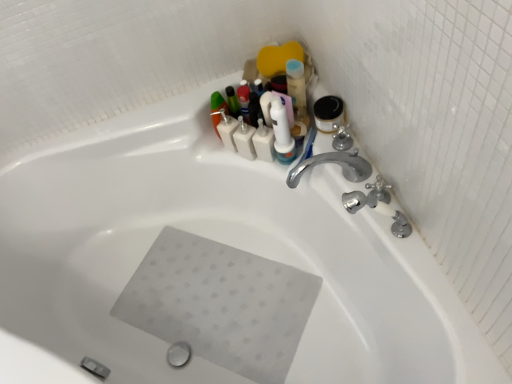
Question: From a real-world perspective, is silver metallic faucet at upper right, the second plumbing fixture positioned from the back, over white plastic toothbrush at upper center, which is the first toiletry from right to left?

Choices:
 (A) yes
 (B) no

Answer: (A)

Question: Is silver metallic faucet at upper right, which ranks as the first plumbing fixture in front-to-back order, far away from white plastic toothbrush at upper center, the 2th toiletry when ordered from left to right?

Choices:
 (A) no
 (B) yes

Answer: (A)

Question: Does silver metallic faucet at upper right, the second plumbing fixture positioned from the back, have a smaller size compared to white plastic toothbrush at upper center, the 2th toiletry when ordered from left to right?

Choices:
 (A) no
 (B) yes

Answer: (A)

Question: From the image's perspective, is silver metallic faucet at upper right, which ranks as the first plumbing fixture in front-to-back order, beneath white plastic toothbrush at upper center, the 2th toiletry when ordered from left to right?

Choices:
 (A) no
 (B) yes

Answer: (B)

Question: Does silver metallic faucet at upper right, which ranks as the first plumbing fixture in front-to-back order, have a larger size compared to white plastic toothbrush at upper center, which is the first toiletry from right to left?

Choices:
 (A) no
 (B) yes

Answer: (B)

Question: Is silver metallic faucet at upper right, the second plumbing fixture positioned from the back, shorter than white plastic toothbrush at upper center, the 2th toiletry when ordered from left to right?

Choices:
 (A) yes
 (B) no

Answer: (B)

Question: From the image's perspective, is white plastic toothbrush at upper center, which is the first toiletry from right to left, under white matte bottles at upper center, marked as the first toiletry in a left-to-right arrangement?

Choices:
 (A) no
 (B) yes

Answer: (B)

Question: From the image's perspective, does white plastic toothbrush at upper center, which is the first toiletry from right to left, appear higher than white matte bottles at upper center, marked as the first toiletry in a left-to-right arrangement?

Choices:
 (A) yes
 (B) no

Answer: (B)

Question: Can you confirm if white plastic toothbrush at upper center, which is the first toiletry from right to left, is thinner than white matte bottles at upper center, which appears as the 2th toiletry when viewed from the right?

Choices:
 (A) no
 (B) yes

Answer: (B)

Question: Considering the relative sizes of white plastic toothbrush at upper center, the 2th toiletry when ordered from left to right, and white matte bottles at upper center, which appears as the 2th toiletry when viewed from the right, in the image provided, is white plastic toothbrush at upper center, the 2th toiletry when ordered from left to right, bigger than white matte bottles at upper center, which appears as the 2th toiletry when viewed from the right,?

Choices:
 (A) yes
 (B) no

Answer: (B)

Question: From a real-world perspective, is white plastic toothbrush at upper center, the 2th toiletry when ordered from left to right, positioned under white matte bottles at upper center, which appears as the 2th toiletry when viewed from the right, based on gravity?

Choices:
 (A) yes
 (B) no

Answer: (B)

Question: Is white plastic toothbrush at upper center, which is the first toiletry from right to left, behind white matte bottles at upper center, which appears as the 2th toiletry when viewed from the right?

Choices:
 (A) no
 (B) yes

Answer: (A)

Question: From the image's perspective, does satin nickel faucet at upper right, the 1th plumbing fixture when ordered from back to front, appear higher than white plastic toothbrush at upper center, the 2th toiletry when ordered from left to right?

Choices:
 (A) no
 (B) yes

Answer: (A)